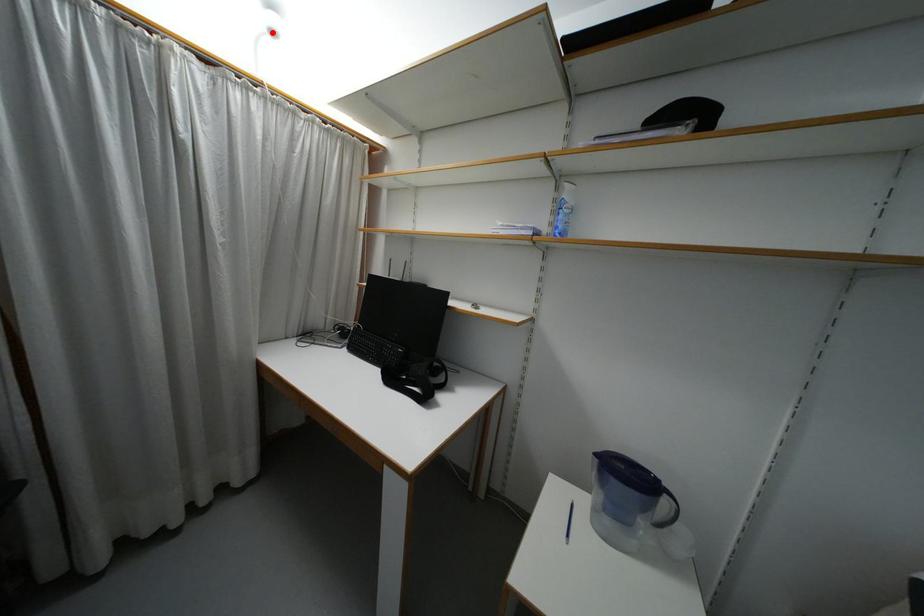
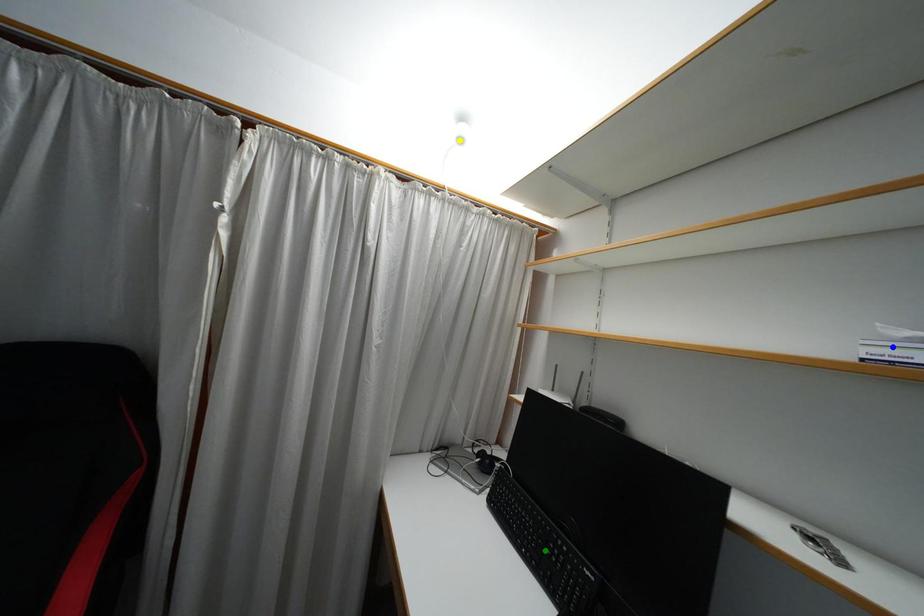
Question: I am providing you with two images of the same scene from different viewpoints. A red point is marked on the first image. You are given multiple points on the second image. Which spot in image 2 lines up with the point in image 1?

Choices:
 (A) green point
 (B) blue point
 (C) yellow point

Answer: (C)